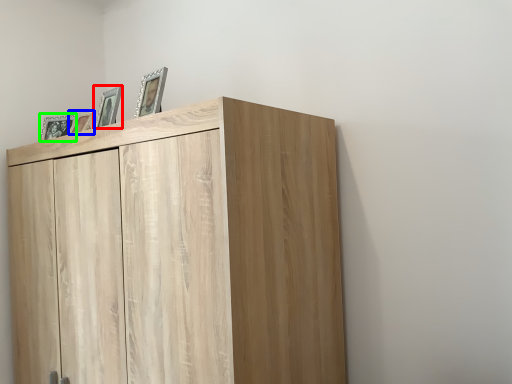
Question: Which object is the farthest from picture frame (highlighted by a red box)? Choose among these: picture frame (highlighted by a blue box) or picture frame (highlighted by a green box).

Choices:
 (A) picture frame
 (B) picture frame

Answer: (B)